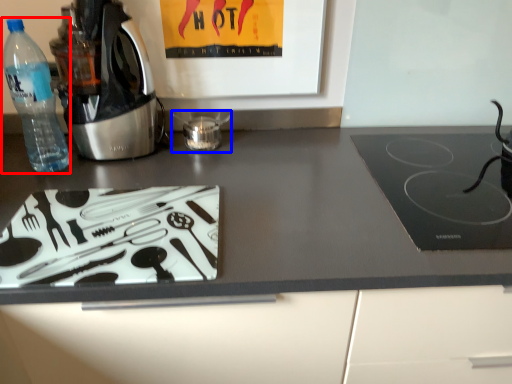
Question: Among these objects, which one is nearest to the camera, bottle (highlighted by a red box) or appliance (highlighted by a blue box)?

Choices:
 (A) bottle
 (B) appliance

Answer: (A)